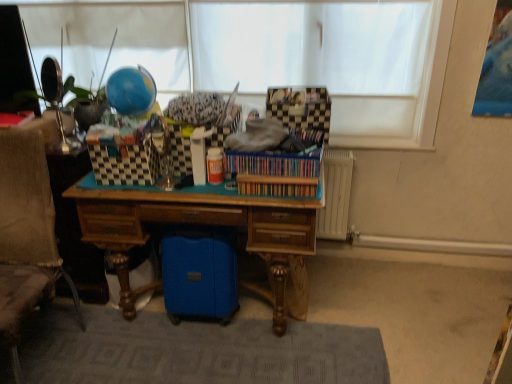
Identify the location of vacant area on top of multicolored cardboard box at center, the first book from the top (from a real-world perspective). (274, 139).